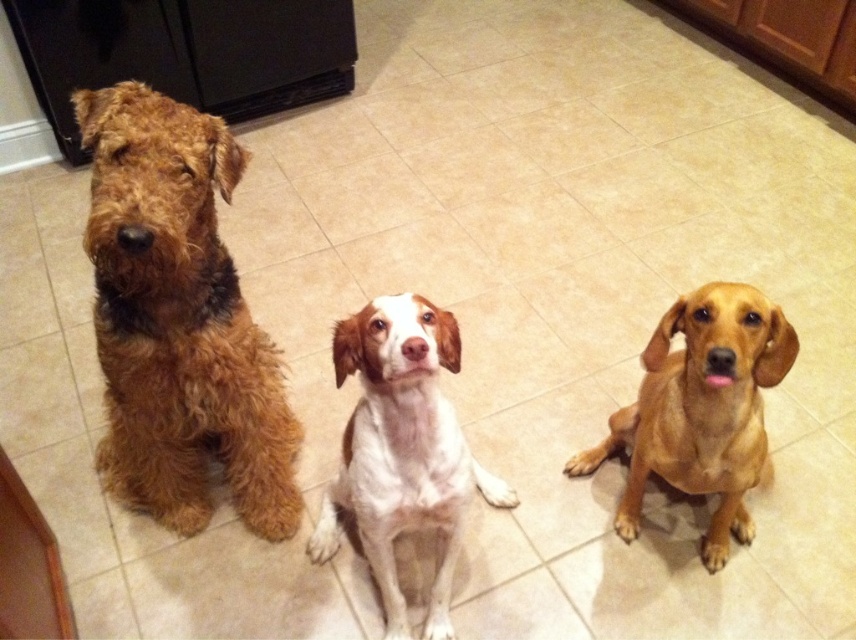
Can you confirm if white soft fur dog at center is wider than golden smooth coat dog at center?

Incorrect, white soft fur dog at center's width does not surpass golden smooth coat dog at center's.

How much distance is there between white soft fur dog at center and golden smooth coat dog at center?

They are 18.75 inches apart.

Where is `white soft fur dog at center`? white soft fur dog at center is located at coordinates (402, 451).

The width and height of the screenshot is (856, 640). I want to click on white soft fur dog at center, so (x=402, y=451).

Is fuzzy brown dog at left to the left of golden smooth coat dog at center from the viewer's perspective?

Correct, you'll find fuzzy brown dog at left to the left of golden smooth coat dog at center.

Is point (122, 250) more distant than point (715, 513)?

No, (122, 250) is in front of (715, 513).

I want to click on fuzzy brown dog at left, so click(x=177, y=321).

Does fuzzy brown dog at left have a greater height compared to white soft fur dog at center?

Yes.

Is fuzzy brown dog at left below white soft fur dog at center?

No.

I want to click on fuzzy brown dog at left, so click(177, 321).

Find the location of `fuzzy brown dog at left`. fuzzy brown dog at left is located at coordinates (177, 321).